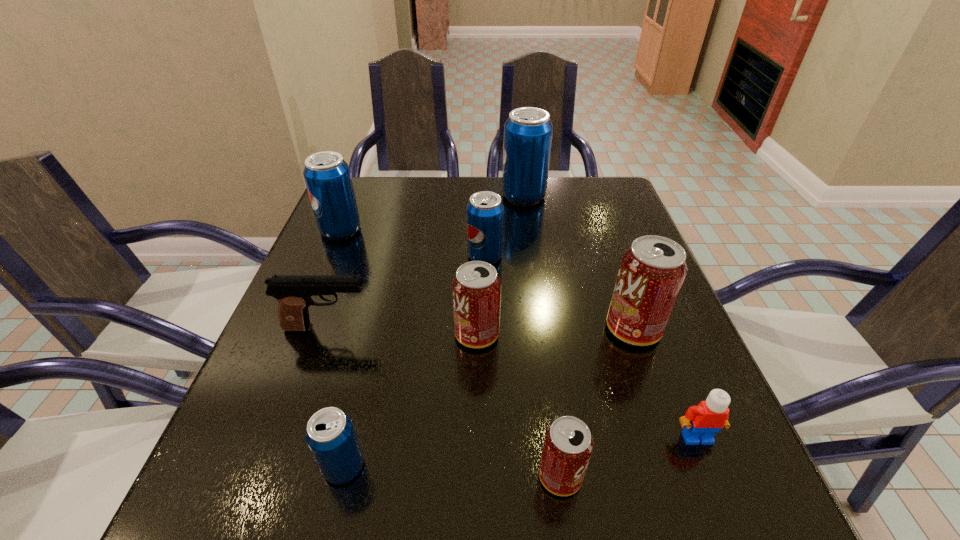
At what (x,y) coordinates should I click in order to perform the action: click on blank space at the near edge of the desktop. Please return your answer as a coordinate pair (x, y). Looking at the image, I should click on (579, 521).

Image resolution: width=960 pixels, height=540 pixels. I want to click on vacant point at the left edge, so click(372, 230).

Where is `vacant space at the far left corner`? This screenshot has height=540, width=960. vacant space at the far left corner is located at coordinates (359, 183).

At what (x,y) coordinates should I click in order to perform the action: click on free space at the near left corner of the desktop. Please return your answer as a coordinate pair (x, y). The image size is (960, 540). Looking at the image, I should click on (288, 491).

Image resolution: width=960 pixels, height=540 pixels. Identify the location of vacant space at the near right corner of the desktop. (714, 498).

Where is `free space between the pistol and the farthest object`? free space between the pistol and the farthest object is located at coordinates (425, 262).

Image resolution: width=960 pixels, height=540 pixels. Find the location of `vacant area between the leftmost red soda can and the white Lego`. vacant area between the leftmost red soda can and the white Lego is located at coordinates (587, 386).

Where is `free space between the biggest red soda can and the rightmost blue pop soda`? free space between the biggest red soda can and the rightmost blue pop soda is located at coordinates (579, 262).

The image size is (960, 540). I want to click on empty location between the biggest blue pop soda and the pistol, so click(425, 262).

Where is `free area in between the third farthest soda can and the smallest blue pop soda`? The height and width of the screenshot is (540, 960). free area in between the third farthest soda can and the smallest blue pop soda is located at coordinates (414, 361).